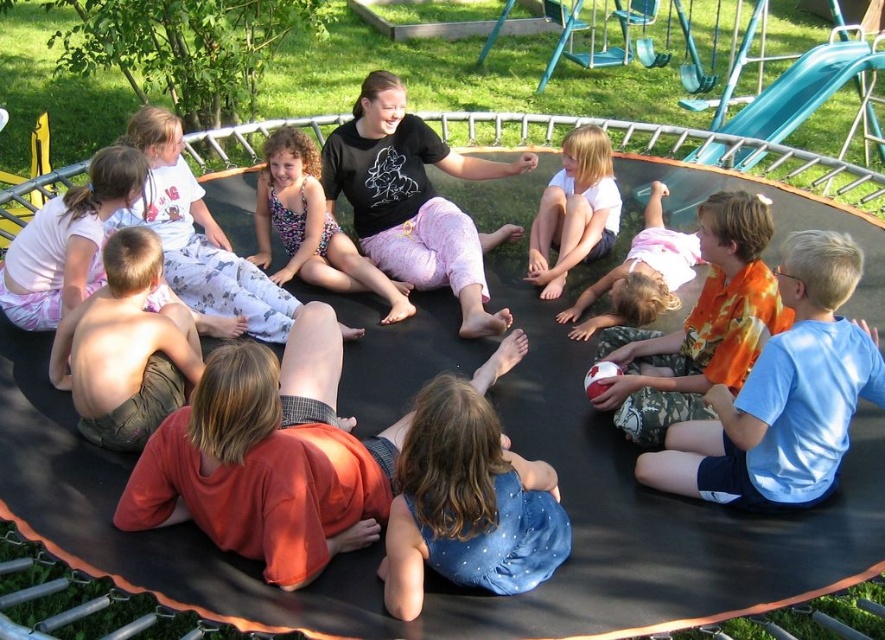
Measure the distance between orange tie-dye shirt at right and black cotton shirt at center.

orange tie-dye shirt at right is 7.14 feet from black cotton shirt at center.

Which is more to the right, orange tie-dye shirt at right or black cotton shirt at center?

From the viewer's perspective, orange tie-dye shirt at right appears more on the right side.

You are a GUI agent. You are given a task and a screenshot of the screen. Output one action in this format:
    pyautogui.click(x=<x>, y=<y>)
    Task: Click on the orange tie-dye shirt at right
    
    Given the screenshot: What is the action you would take?
    pyautogui.click(x=699, y=326)

Is orange cotton shirt at center shorter than blue cotton shirt at lower right?

Correct, orange cotton shirt at center is not as tall as blue cotton shirt at lower right.

Is orange cotton shirt at center bigger than blue cotton shirt at lower right?

Indeed, orange cotton shirt at center has a larger size compared to blue cotton shirt at lower right.

Image resolution: width=885 pixels, height=640 pixels. I want to click on orange cotton shirt at center, so click(268, 458).

Based on the photo, who is positioned more to the right, teal plastic slide at upper right or pink fabric dress at lower center?

Positioned to the right is teal plastic slide at upper right.

Does point (806, 113) lie in front of point (622, 301)?

No, it is not.

The image size is (885, 640). I want to click on teal plastic slide at upper right, so click(786, 104).